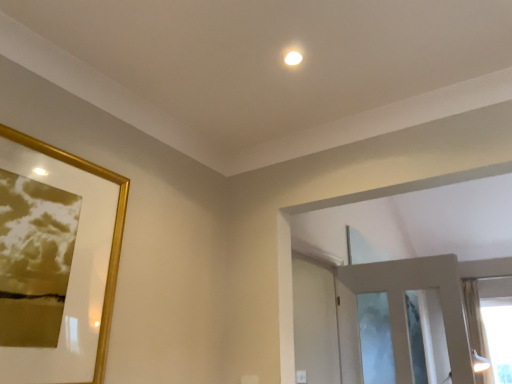
Question: Can you see white glossy screen door at center touching sheer fabric curtain at right?

Choices:
 (A) no
 (B) yes

Answer: (A)

Question: Is white glossy screen door at center in front of sheer fabric curtain at right?

Choices:
 (A) yes
 (B) no

Answer: (A)

Question: From a real-world perspective, is white glossy screen door at center on sheer fabric curtain at right?

Choices:
 (A) yes
 (B) no

Answer: (B)

Question: Is white glossy screen door at center not near sheer fabric curtain at right?

Choices:
 (A) no
 (B) yes

Answer: (B)

Question: From the image's perspective, is white glossy screen door at center over sheer fabric curtain at right?

Choices:
 (A) no
 (B) yes

Answer: (B)

Question: Considering the relative sizes of white glossy screen door at center and sheer fabric curtain at right in the image provided, is white glossy screen door at center smaller than sheer fabric curtain at right?

Choices:
 (A) no
 (B) yes

Answer: (A)

Question: From a real-world perspective, is sheer fabric curtain at right physically above white glossy screen door at center?

Choices:
 (A) no
 (B) yes

Answer: (B)

Question: From the image's perspective, is sheer fabric curtain at right located beneath white glossy screen door at center?

Choices:
 (A) yes
 (B) no

Answer: (A)

Question: Can you confirm if sheer fabric curtain at right is shorter than white glossy screen door at center?

Choices:
 (A) yes
 (B) no

Answer: (B)

Question: Is white glossy screen door at center located within sheer fabric curtain at right?

Choices:
 (A) no
 (B) yes

Answer: (A)

Question: From a real-world perspective, does sheer fabric curtain at right sit lower than white glossy screen door at center?

Choices:
 (A) yes
 (B) no

Answer: (B)

Question: Is sheer fabric curtain at right bigger than white glossy screen door at center?

Choices:
 (A) yes
 (B) no

Answer: (B)

Question: From a real-world perspective, is sheer fabric curtain at right physically above gold glossy picture frame at upper left?

Choices:
 (A) no
 (B) yes

Answer: (B)